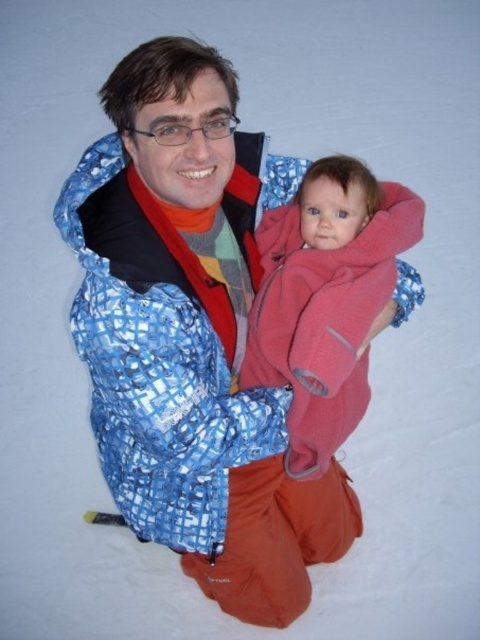
Question: Which object is closer to the camera taking this photo?

Choices:
 (A) blue checkered jacket at center
 (B) soft pink fleece at center

Answer: (A)

Question: Among these objects, which one is farthest from the camera?

Choices:
 (A) blue checkered jacket at center
 (B) soft pink fleece at center

Answer: (B)

Question: Which point is farther from the camera taking this photo?

Choices:
 (A) (324, 412)
 (B) (104, 340)

Answer: (A)

Question: Is blue checkered jacket at center to the right of soft pink fleece at center from the viewer's perspective?

Choices:
 (A) no
 (B) yes

Answer: (A)

Question: Can you confirm if blue checkered jacket at center is positioned to the left of soft pink fleece at center?

Choices:
 (A) no
 (B) yes

Answer: (B)

Question: Observing the image, what is the correct spatial positioning of blue checkered jacket at center in reference to soft pink fleece at center?

Choices:
 (A) below
 (B) above

Answer: (A)